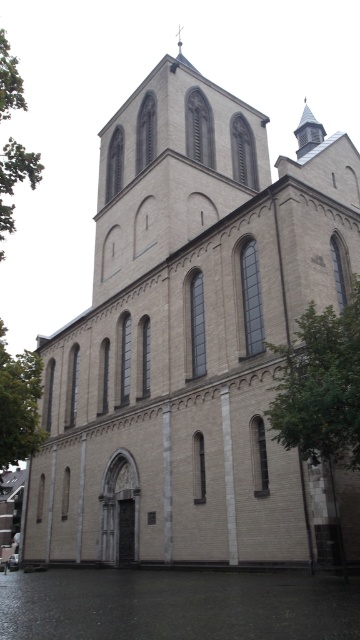
You are standing in front of the historic church and see a point marked at coordinates (321, 385). What object is located at this point?

The point at coordinates (321, 385) indicates a green leafy tree at the right.

You are standing in front of the historic church building and notice a point marked at coordinates [177,604]. Based on the scene, can you determine what surface this point is located on?

The point is on dark gray water at lower center.